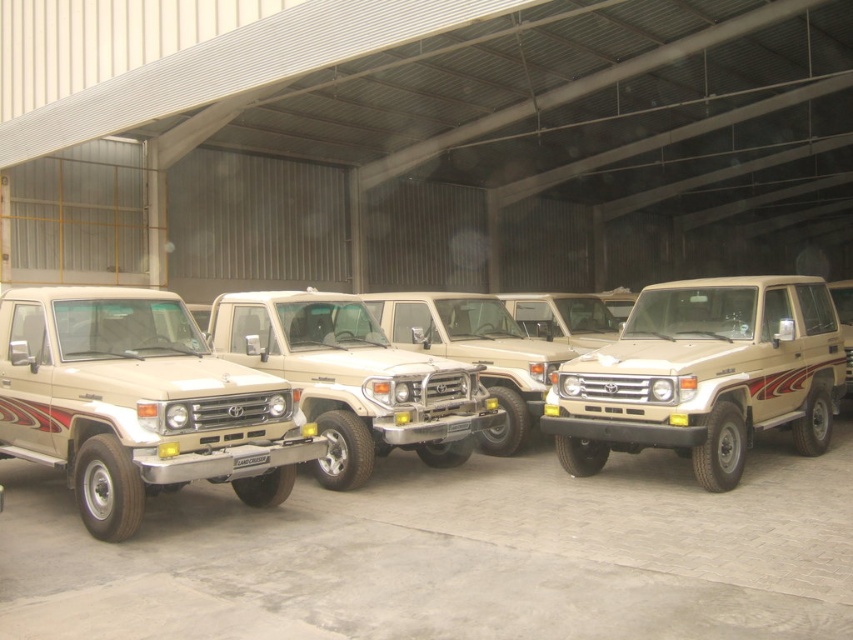
Consider the image. You are a delivery person who needs to load a package onto the roof of one of the jeeps. The package requires a minimum of 2 meters of clearance from the ground to the roof. Which jeep between the matte beige jeep at center and the satin beige jeep at center can accommodate this requirement?

The matte beige jeep at center is much taller than the satin beige jeep at center, so it can provide the required 2 meters of clearance from the ground to the roof.